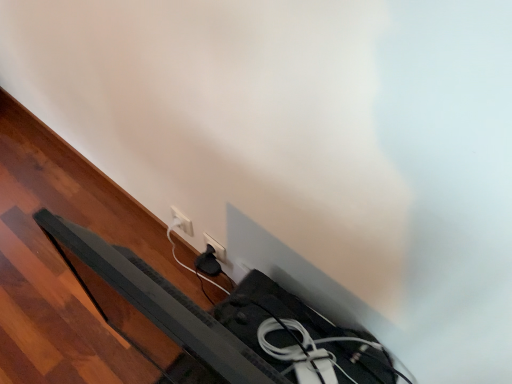
Question: Is white plastic socket at lower center, positioned as the second power plugs and sockets in right-to-left order, looking in the opposite direction of black plastic bed frame at lower left?

Choices:
 (A) yes
 (B) no

Answer: (B)

Question: From the image's perspective, would you say white plastic socket at lower center, positioned as the second power plugs and sockets in right-to-left order, is positioned over black plastic bed frame at lower left?

Choices:
 (A) no
 (B) yes

Answer: (B)

Question: Is the depth of white plastic socket at lower center, which is counted as the first power plugs and sockets, starting from the left, greater than that of black plastic bed frame at lower left?

Choices:
 (A) no
 (B) yes

Answer: (B)

Question: Is white plastic socket at lower center, positioned as the second power plugs and sockets in right-to-left order, smaller than black plastic bed frame at lower left?

Choices:
 (A) no
 (B) yes

Answer: (B)

Question: Is white plastic socket at lower center, which is counted as the first power plugs and sockets, starting from the left, positioned in front of black plastic bed frame at lower left?

Choices:
 (A) no
 (B) yes

Answer: (A)

Question: Considering the positions of white plastic socket at lower center, positioned as the second power plugs and sockets in right-to-left order, and black plastic bed frame at lower left in the image, is white plastic socket at lower center, positioned as the second power plugs and sockets in right-to-left order, bigger or smaller than black plastic bed frame at lower left?

Choices:
 (A) small
 (B) big

Answer: (A)

Question: Based on their positions, is white plastic socket at lower center, which is counted as the first power plugs and sockets, starting from the left, located to the left or right of black plastic bed frame at lower left?

Choices:
 (A) right
 (B) left

Answer: (B)

Question: From the image's perspective, is white plastic socket at lower center, which is counted as the first power plugs and sockets, starting from the left, located above or below black plastic bed frame at lower left?

Choices:
 (A) above
 (B) below

Answer: (A)

Question: Considering the positions of white plastic socket at lower center, which is counted as the first power plugs and sockets, starting from the left, and black plastic bed frame at lower left in the image, is white plastic socket at lower center, which is counted as the first power plugs and sockets, starting from the left, taller or shorter than black plastic bed frame at lower left?

Choices:
 (A) short
 (B) tall

Answer: (A)

Question: Is black plastic bed frame at lower left wider or thinner than white plastic socket at lower center, which is counted as the first power plugs and sockets, starting from the left?

Choices:
 (A) wide
 (B) thin

Answer: (A)

Question: Considering the positions of black plastic bed frame at lower left and white plastic socket at lower center, positioned as the second power plugs and sockets in right-to-left order, in the image, is black plastic bed frame at lower left taller or shorter than white plastic socket at lower center, positioned as the second power plugs and sockets in right-to-left order,?

Choices:
 (A) tall
 (B) short

Answer: (A)

Question: Relative to white plastic socket at lower center, positioned as the second power plugs and sockets in right-to-left order, is black plastic bed frame at lower left in front or behind?

Choices:
 (A) front
 (B) behind

Answer: (A)

Question: From the image's perspective, is black plastic bed frame at lower left located above or below white plastic socket at lower center, positioned as the second power plugs and sockets in right-to-left order?

Choices:
 (A) above
 (B) below

Answer: (B)

Question: From the image's perspective, is white plastic socket at lower center, positioned as the second power plugs and sockets in right-to-left order, located above or below white plastic power plug at lower center, arranged as the second power plugs and sockets when viewed from the left?

Choices:
 (A) below
 (B) above

Answer: (B)

Question: Is white plastic socket at lower center, which is counted as the first power plugs and sockets, starting from the left, inside the boundaries of white plastic power plug at lower center, the first power plugs and sockets positioned from the right, or outside?

Choices:
 (A) inside
 (B) outside

Answer: (B)